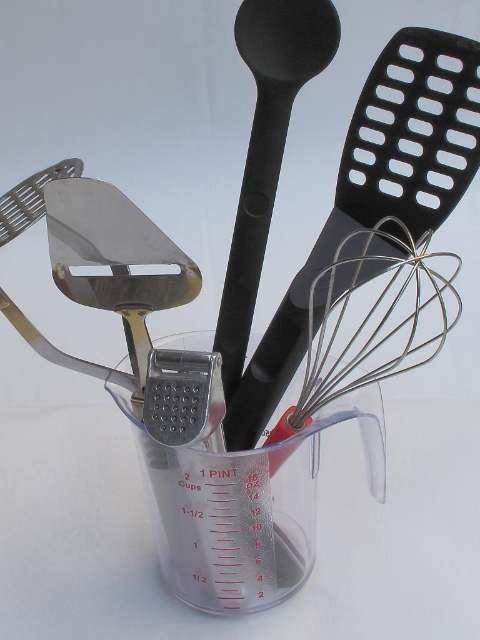
You are organizing kitchen utensils in a clear plastic cup with red measurement markings. You have a black plastic spatula at upper right and a black matte spoon at center. According to their positions, which utensil is closer to the bottom of the cup?

The black plastic spatula at upper right is located below the black matte spoon at center, so it is closer to the bottom of the cup.

What object is located at the point with coordinates (376, 193) in the image?

The point with coordinates (376, 193) marks the black plastic spatula at upper right.

From the picture: You are a chef preparing to store these utensils back into the measuring cup. You need to ensure the silver wire whisk at center and the black matte spoon at center fit side by side. Can you determine if they can fit next to each other horizontally based on their widths?

The silver wire whisk at center has a larger width than the black matte spoon at center. Since the question is about fitting them side by side horizontally, the total width required would be the sum of both. However, without knowing the exact width of the measuring cup, it is impossible to confirm if they can fit. Please check the cup dimensions.